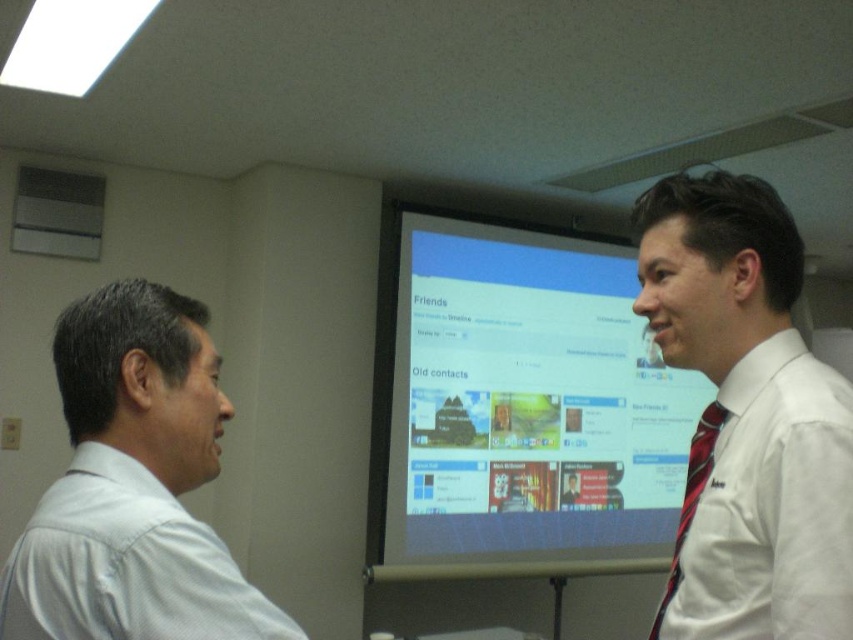
You are organizing a presentation and need to ensure that all visual elements are clearly visible to the audience. The light blue shirt at left and the red striped tie at right are part of the presenter attire. Which clothing item should be adjusted in size to ensure visibility, and why?

The light blue shirt at left has a smaller size compared to the red striped tie at right. To ensure visibility, the light blue shirt at left should be made larger so that its details can be seen clearly by the audience.

You are standing in the conference room and looking at the two points marked on the screen. Which point, the point at coordinates (x=811, y=380) or the point at (x=206, y=410), is closer to you?

The point at coordinates (x=811, y=380) is closer to you because it is closer to the camera than the other point.